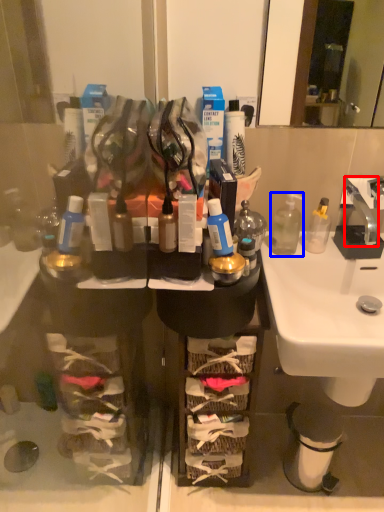
Question: Which object is further to the camera taking this photo, faucet (highlighted by a red box) or bottle (highlighted by a blue box)?

Choices:
 (A) faucet
 (B) bottle

Answer: (B)